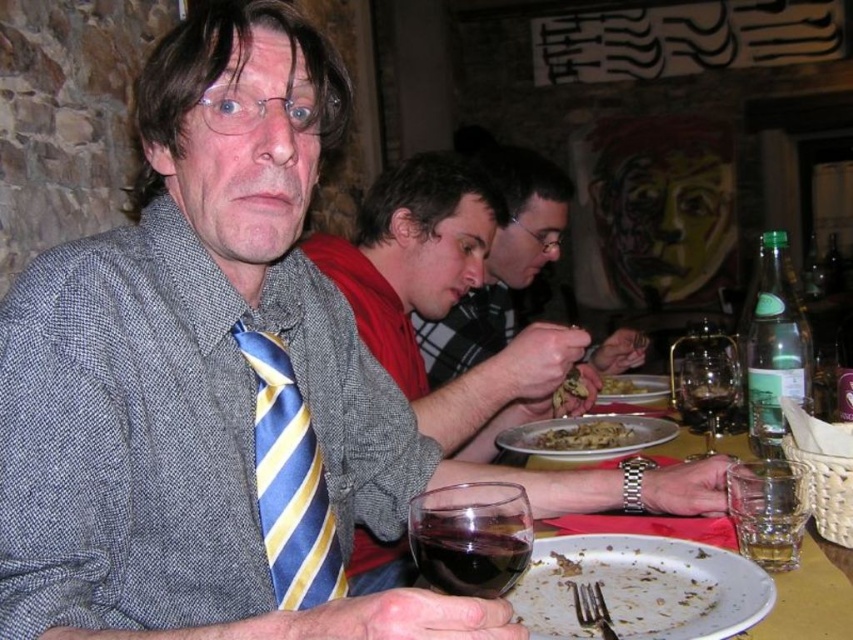
You are a food critic who just arrived at the restaurant. You see the brown crumbly bread at center and the golden brown pasta at center on the table. Which of these two items is taller?

The brown crumbly bread at center is taller than the golden brown pasta at center.

You are a server in a restaurant and need to clear the dishes. You see the white porcelain plate at center and the yellowish matte pasta at center on the table. Which item should you pick up first to ensure the pasta remains intact?

You should pick up the white porcelain plate at center first because its width is larger than the yellowish matte pasta at center, so lifting the plate will not disturb the pasta as much.

You are a waiter in a restaurant and you see the yellowish matte pasta at center and the white matte plate at center on the table. Which one is closer to the left side of the table?

The yellowish matte pasta at center is closer to the left side of the table since it is positioned to the left of the white matte plate at center.